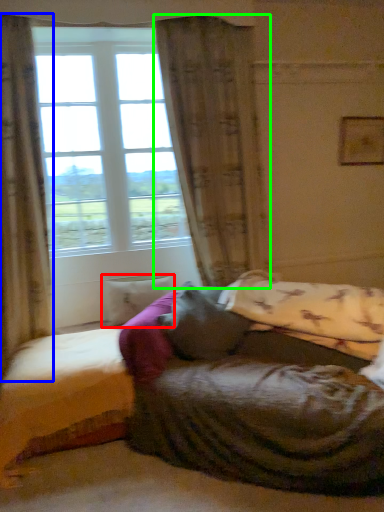
Question: Considering the real-world distances, which object is farthest from pillow (highlighted by a red box)? curtain (highlighted by a blue box) or curtain (highlighted by a green box)?

Choices:
 (A) curtain
 (B) curtain

Answer: (B)